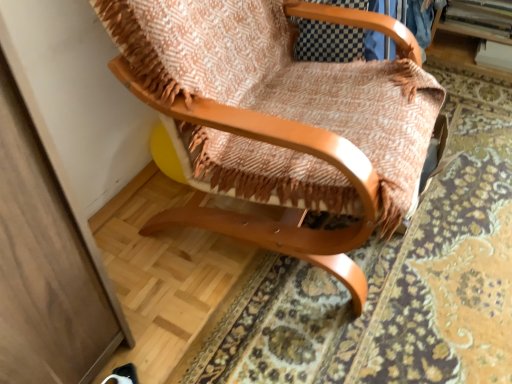
Question: From the image's perspective, is wooden chair at center positioned above or below woven fabric mat at center?

Choices:
 (A) below
 (B) above

Answer: (B)

Question: Is wooden chair at center spatially inside woven fabric mat at center, or outside of it?

Choices:
 (A) outside
 (B) inside

Answer: (A)

Question: Is wooden chair at center bigger or smaller than woven fabric mat at center?

Choices:
 (A) big
 (B) small

Answer: (A)

Question: In the image, is woven fabric mat at center on the left side or the right side of wooden chair at center?

Choices:
 (A) left
 (B) right

Answer: (B)

Question: From a real-world perspective, relative to wooden chair at center, is woven fabric mat at center vertically above or below?

Choices:
 (A) below
 (B) above

Answer: (A)

Question: From their relative heights in the image, would you say woven fabric mat at center is taller or shorter than wooden chair at center?

Choices:
 (A) short
 (B) tall

Answer: (A)

Question: Is point (502, 140) closer or farther from the camera than point (266, 71)?

Choices:
 (A) closer
 (B) farther

Answer: (B)